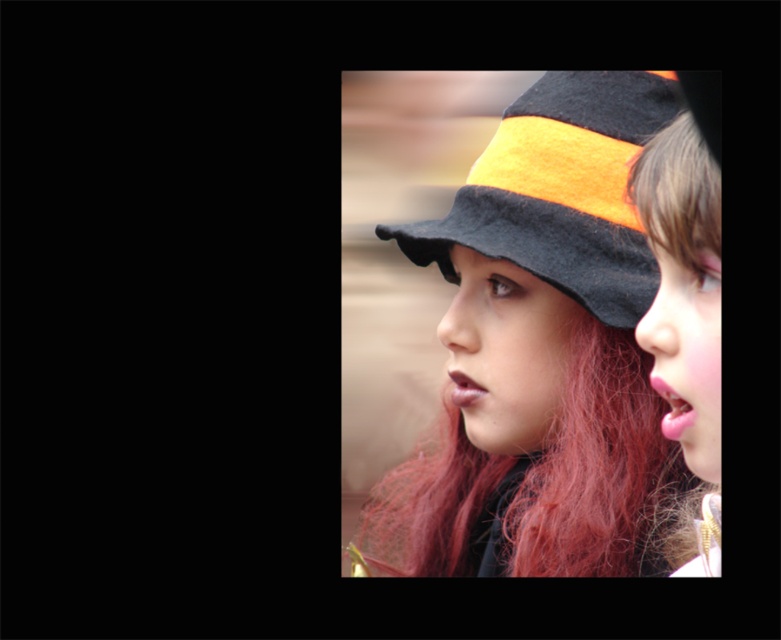
You are a photographer adjusting the lighting for a portrait. You need to ensure that both the smooth orange hat at right and the blonde silky hair at upper right are well lit. Given their height difference, which object should you adjust the light first to ensure proper exposure?

The smooth orange hat at right is much taller than the blonde silky hair at upper right, so you should adjust the light for the smooth orange hat at right first to ensure proper exposure.

From the picture: You are a photographer adjusting the camera focus. You need to ensure both the orange felt hat at center and the smooth orange hat at right are in focus. The camera can only focus on objects within a 7 inch range. Can both hats be in focus at the same time?

The orange felt hat at center and smooth orange hat at right are 8.54 inches apart from each other. Since the camera can only focus on objects within a 7 inch range, the distance between them exceeds the focus range. Therefore, both hats cannot be in focus simultaneously.